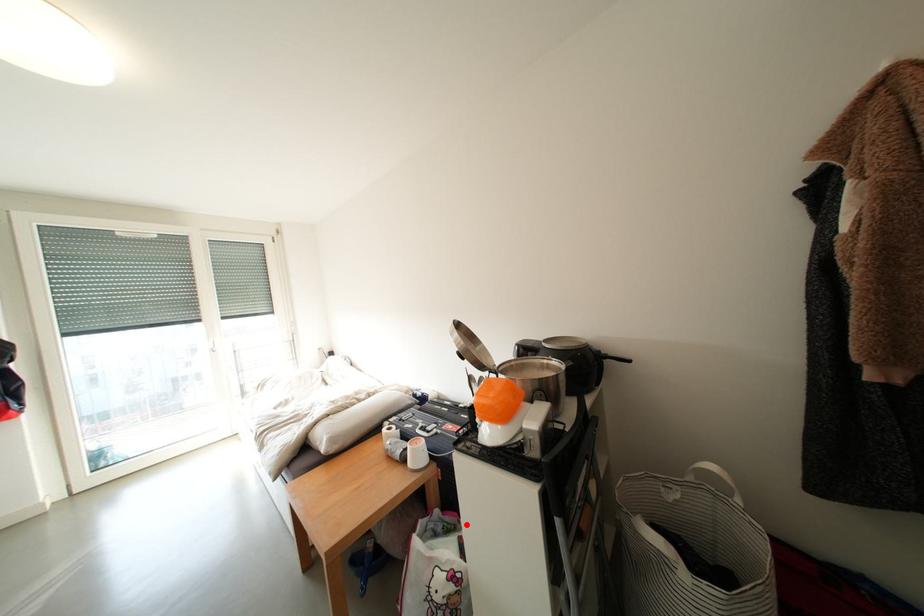
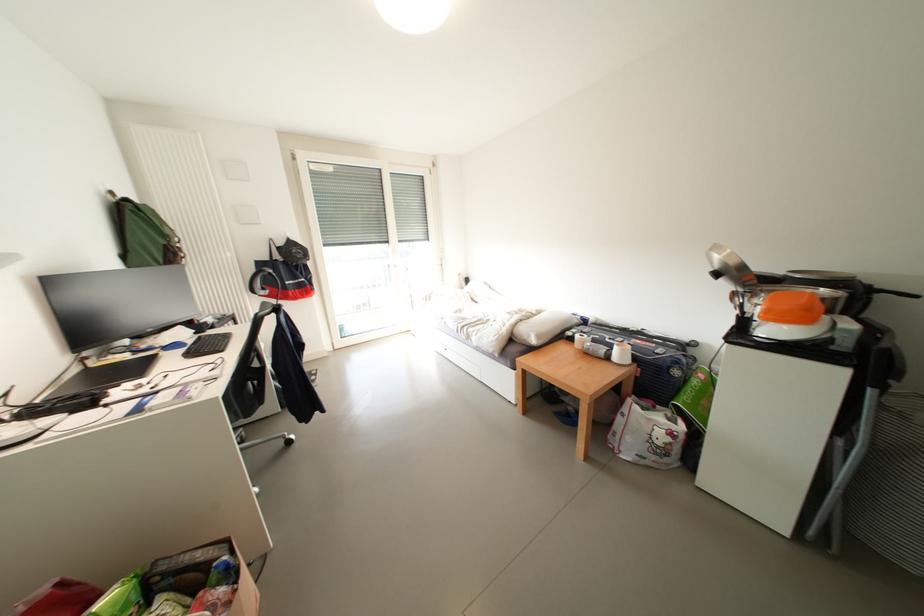
Question: I am providing you with two images of the same scene from different viewpoints. A red point is shown in image1. For the corresponding object point in image2, is it positioned nearer or farther from the camera?

Choices:
 (A) Nearer
 (B) Farther

Answer: (A)